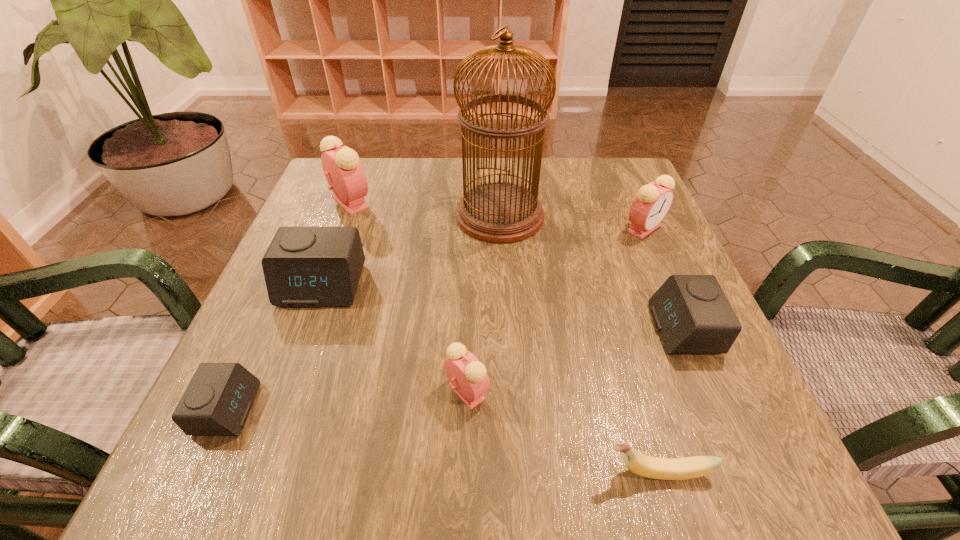
At what (x,y) coordinates should I click in order to perform the action: click on vacant space located 0.300m on the front-facing side of the second biggest black alarm clock. Please return your answer as a coordinate pair (x, y). The height and width of the screenshot is (540, 960). Looking at the image, I should click on (482, 329).

Where is `vacant space located on the front-facing side of the second biggest black alarm clock`? The height and width of the screenshot is (540, 960). vacant space located on the front-facing side of the second biggest black alarm clock is located at coordinates (569, 329).

Where is `vacant region located on the front-facing side of the second biggest black alarm clock`? vacant region located on the front-facing side of the second biggest black alarm clock is located at coordinates coord(534,329).

Find the location of a particular element. free space located 0.270m at the stem of the banana is located at coordinates (400, 472).

This screenshot has height=540, width=960. Identify the location of vacant space located 0.340m at the stem of the banana. (348, 472).

At what (x,y) coordinates should I click in order to perform the action: click on vacant region located at the stem of the banana. Please return your answer as a coordinate pair (x, y). This screenshot has height=540, width=960. Looking at the image, I should click on click(x=468, y=472).

I want to click on free space located on the front-facing side of the shortest alarm clock, so click(400, 409).

The height and width of the screenshot is (540, 960). What are the coordinates of `birdcage positioned at the far edge` in the screenshot? It's located at (499, 212).

At what (x,y) coordinates should I click in order to perform the action: click on alarm clock that is at the far edge. Please return your answer as a coordinate pair (x, y). Looking at the image, I should click on (344, 173).

Where is `banana present at the near edge`? banana present at the near edge is located at coordinates pos(646,466).